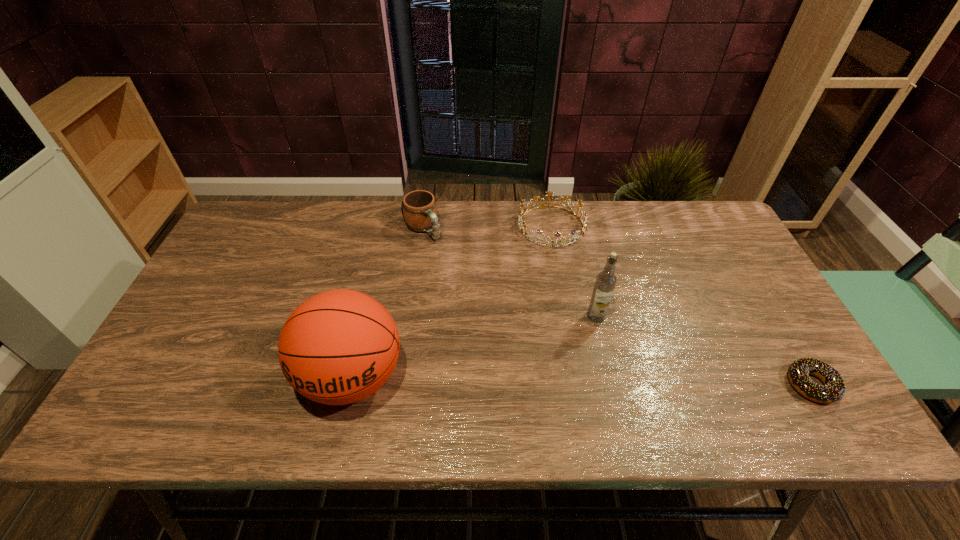
Identify the location of unoccupied position between the doughnut and the basketball. (582, 381).

You are a GUI agent. You are given a task and a screenshot of the screen. Output one action in this format:
    pyautogui.click(x=<x>, y=<y>)
    Task: Click on the vacant space that is in between the third nearest object and the mug
    
    Given the screenshot: What is the action you would take?
    pyautogui.click(x=510, y=272)

Find the location of a particular element. The height and width of the screenshot is (540, 960). free area in between the third nearest object and the rightmost object is located at coordinates (704, 350).

The image size is (960, 540). What are the coordinates of `vacant space in between the basketball and the vodka` in the screenshot? It's located at (474, 347).

Locate an element on the screen. empty location between the basketball and the doughnut is located at coordinates (582, 381).

Find the location of a particular element. empty space that is in between the basketball and the third farthest object is located at coordinates (474, 347).

The image size is (960, 540). What are the coordinates of `vacant space that's between the tiara and the basketball` in the screenshot? It's located at (452, 301).

This screenshot has height=540, width=960. Find the location of `object that is the nearest to the third shortest object`. object that is the nearest to the third shortest object is located at coordinates (522, 224).

Select which object is the fourth closest to the mug. Please provide its 2D coordinates. Your answer should be formatted as a tuple, i.e. [(x, y)], where the tuple contains the x and y coordinates of a point satisfying the conditions above.

[(834, 389)]

At what (x,y) coordinates should I click in order to perform the action: click on free space that satisfies the following two spatial constraints: 1. on the side with logo of the basketball; 2. on the right side of the doughnut. Please return your answer as a coordinate pair (x, y). Looking at the image, I should click on (350, 384).